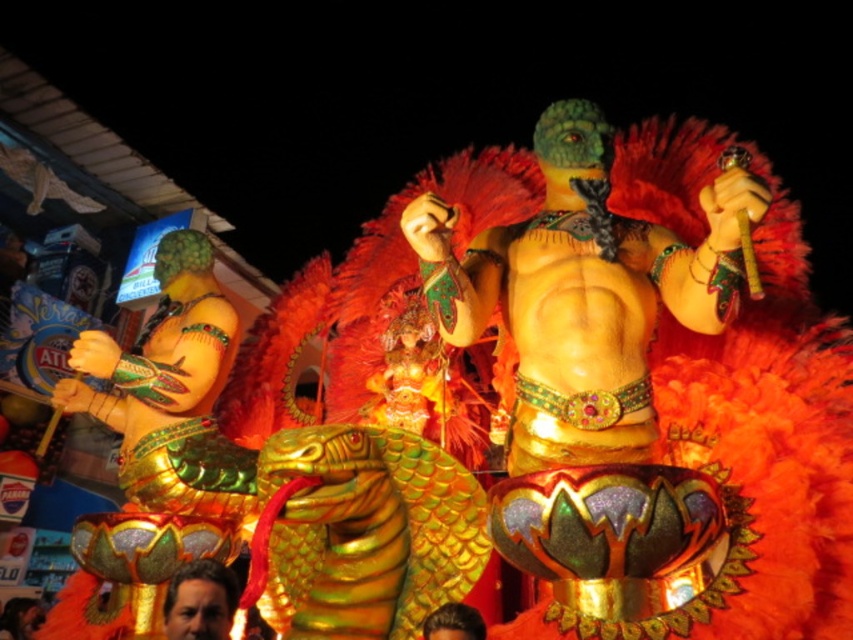
You are a photographer at the parade trying to capture the shiny gold statue at center and the brown hair at center. Which one should you focus on first if you want to take a photo that includes both in the frame?

The shiny gold statue at center is above the brown hair at center, so you should focus on the brown hair at center first to ensure both are in the frame.

You are a photographer trying to capture the best shot of the parade. You notice two points in the scene marked as point 1 at coordinates point (560, 266) and point 2 at coordinates point (190, 624). Based on their positions, which point is closer to the camera?

Point (560, 266) is in front of point (190, 624), so it is closer to the camera.